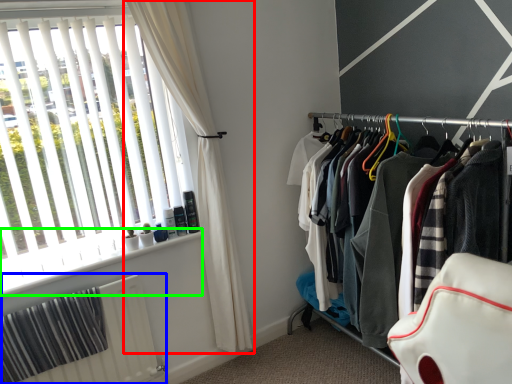
Question: Which object is positioned closest to curtain (highlighted by a red box)? Select from radiator (highlighted by a blue box) and window sill (highlighted by a green box).

Choices:
 (A) radiator
 (B) window sill

Answer: (B)